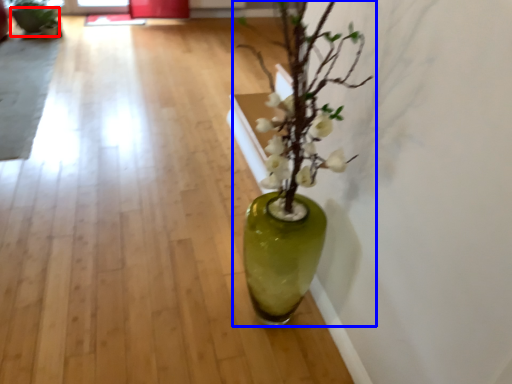
Question: Which object appears farthest to the camera in this image, flowerpot (highlighted by a red box) or houseplant (highlighted by a blue box)?

Choices:
 (A) flowerpot
 (B) houseplant

Answer: (A)